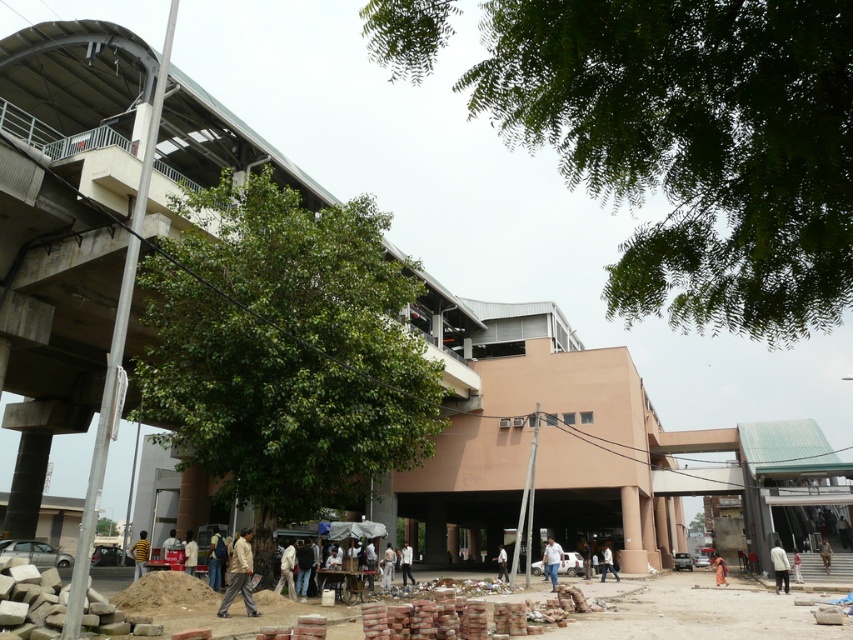
Based on the photo, which of these two, green leafy tree at center or white cotton shirt at center, stands shorter?

white cotton shirt at center

Is point (151, 264) less distant than point (553, 552)?

Yes, it is.

Locate an element on the screen. Image resolution: width=853 pixels, height=640 pixels. green leafy tree at center is located at coordinates (283, 349).

Is point (787, 561) farther from viewer compared to point (141, 564)?

That is True.

Is point (770, 552) behind point (143, 532)?

That is True.

Locate an element on the screen. white matte shirt at lower right is located at coordinates (779, 566).

Who is higher up, white cotton shirt at center or brown fabric person at lower right?

white cotton shirt at center is above.

Describe the element at coordinates (550, 561) in the screenshot. This screenshot has height=640, width=853. I see `white cotton shirt at center` at that location.

Find the location of a particular element. The width and height of the screenshot is (853, 640). white cotton shirt at center is located at coordinates (550, 561).